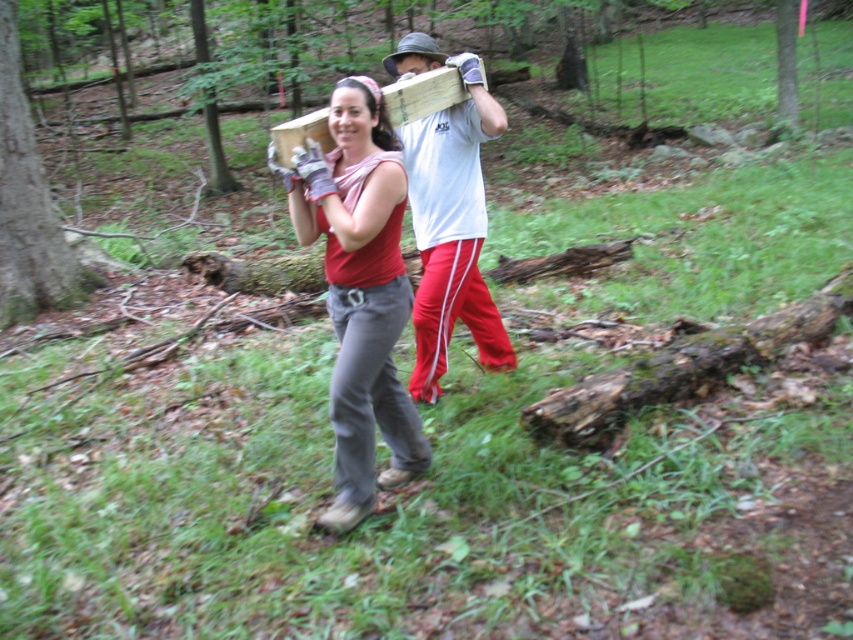
What is the color of the clothing item located at the coordinates point (358, 291)?

The color of the clothing item at point (358, 291) is matte red.